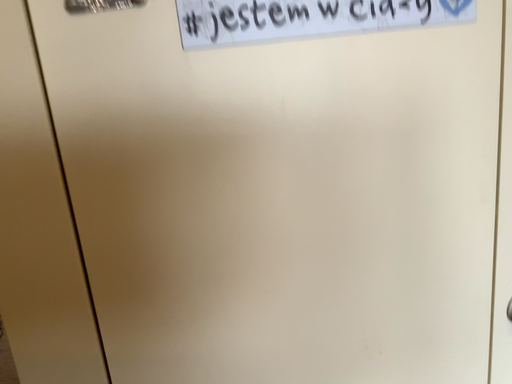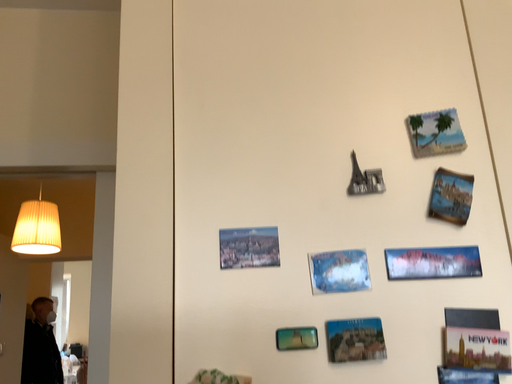
Question: How did the camera likely rotate when shooting the video?

Choices:
 (A) rotated upward
 (B) rotated downward

Answer: (A)